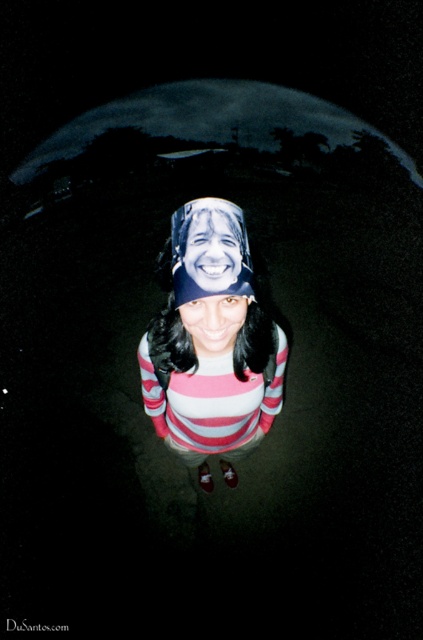
In the scene shown: Who is positioned more to the left, striped cotton shirt at center or matte striped shirt at center?

striped cotton shirt at center

Which is in front, point (241, 211) or point (186, 323)?

Point (241, 211) is in front.

Is point (194, 362) less distant than point (231, 339)?

No, it is behind (231, 339).

Find the location of a particular element. The image size is (423, 640). striped cotton shirt at center is located at coordinates (211, 342).

Who is taller, smooth plastic face at center or matte striped shirt at center?

Standing taller between the two is matte striped shirt at center.

Between point (230, 278) and point (231, 300), which one is positioned behind?

Point (231, 300)

Is point (197, 250) positioned before point (230, 349)?

Yes, it is in front of point (230, 349).

Where is `smooth plastic face at center`? The width and height of the screenshot is (423, 640). smooth plastic face at center is located at coordinates (211, 252).

Between striped cotton shirt at center and smooth plastic face at center, which one appears on the right side from the viewer's perspective?

Positioned to the right is smooth plastic face at center.

Is striped cotton shirt at center below smooth plastic face at center?

Yes, striped cotton shirt at center is below smooth plastic face at center.

Does point (236, 291) come behind point (195, 276)?

Yes, point (236, 291) is farther from viewer.

At what (x,y) coordinates should I click in order to perform the action: click on striped cotton shirt at center. Please return your answer as a coordinate pair (x, y). Image resolution: width=423 pixels, height=640 pixels. Looking at the image, I should click on (211, 342).